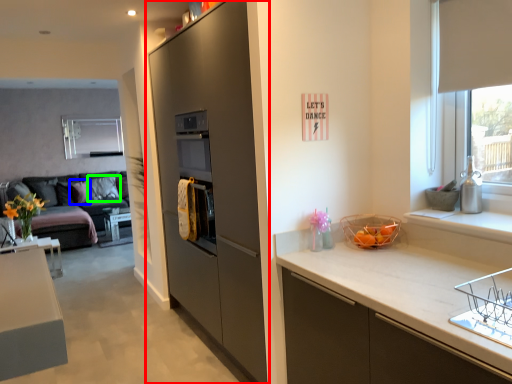
Question: Estimate the real-world distances between objects in this image. Which object is closer to cabinetry (highlighted by a red box), pillow (highlighted by a blue box) or pillow (highlighted by a green box)?

Choices:
 (A) pillow
 (B) pillow

Answer: (B)